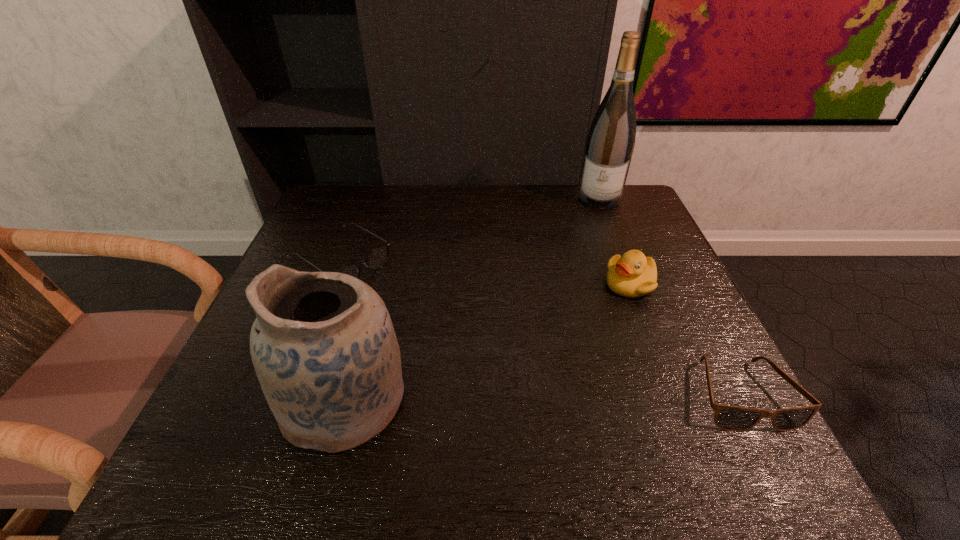
Identify the location of vacant spot on the desktop that is between the second tallest object and the sunglasses and is positioned at the face of the third shortest object. Image resolution: width=960 pixels, height=540 pixels. (527, 397).

Where is `vacant spot on the desktop that is between the second tallest object and the sunglasses and is positioned on the label of the wine bottle`? The height and width of the screenshot is (540, 960). vacant spot on the desktop that is between the second tallest object and the sunglasses and is positioned on the label of the wine bottle is located at coordinates (551, 397).

Identify the location of free space on the desktop that is between the pottery and the sunglasses and is positioned through the lenses of the spectacles. (551, 397).